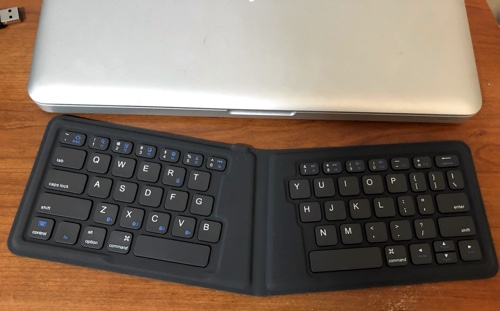
Identify the location of laptop. (267, 55).